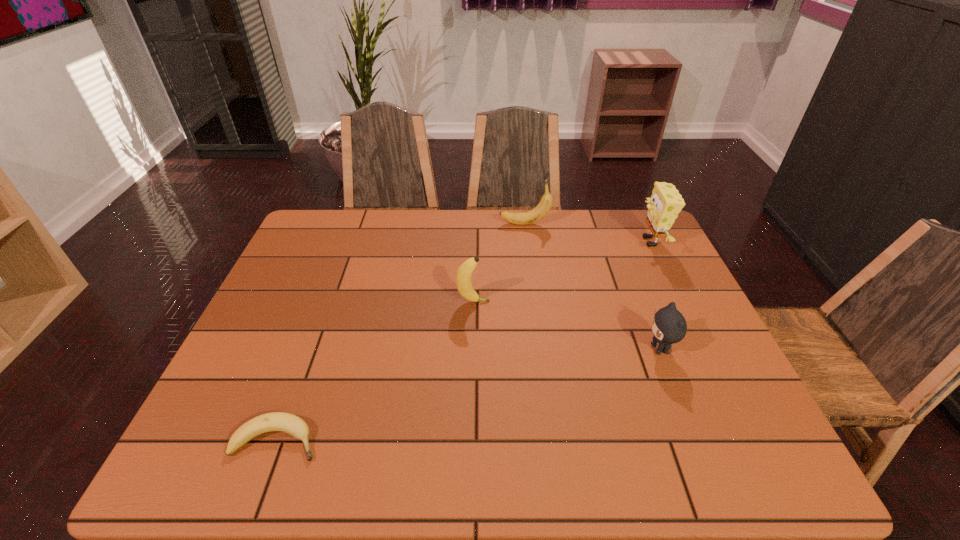
Find the location of a particular element. The height and width of the screenshot is (540, 960). free space that is in between the rightmost object and the nearest object is located at coordinates (464, 341).

Identify the location of free space between the shortest banana and the sponge. (464, 341).

You are a GUI agent. You are given a task and a screenshot of the screen. Output one action in this format:
    pyautogui.click(x=<x>, y=<y>)
    Task: Click on the free space between the rightmost object and the second banana from left to right
    
    Given the screenshot: What is the action you would take?
    pyautogui.click(x=562, y=272)

Image resolution: width=960 pixels, height=540 pixels. Identify the location of object that is the closest to the leftmost banana. point(463,278).

Point out which object is positioned as the third nearest to the second nearest banana. Please provide its 2D coordinates. Your answer should be formatted as a tuple, i.e. [(x, y)], where the tuple contains the x and y coordinates of a point satisfying the conditions above.

[(276, 421)]

This screenshot has height=540, width=960. I want to click on banana that is the second closest to the sponge, so click(x=463, y=278).

What are the coordinates of `banana that is the third closest to the rightmost object` in the screenshot? It's located at (276, 421).